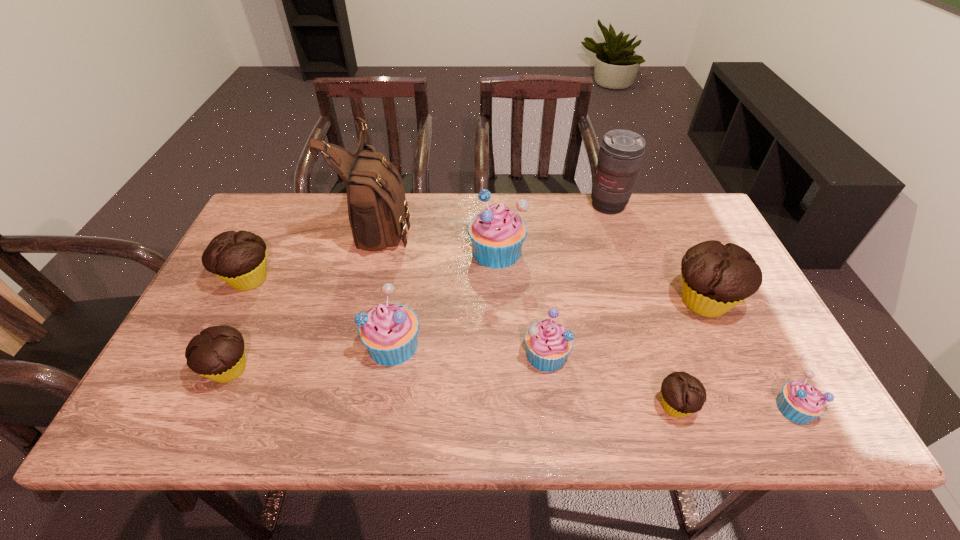
This screenshot has width=960, height=540. I want to click on chocolate muffin that is the third closest one to the sixth muffin from right to left, so click(x=682, y=394).

This screenshot has width=960, height=540. Identify the location of vacant area that satisfies the following two spatial constraints: 1. on the back side of the third muffin from left to right; 2. on the left side of the farthest blue muffin. (408, 251).

Find the location of a particular element. This screenshot has height=540, width=960. free space that satisfies the following two spatial constraints: 1. on the side of the biggest chocolate muffin where the control switches are located; 2. on the left side of the telephoto lens is located at coordinates (640, 302).

Where is `free space that satisfies the following two spatial constraints: 1. on the front side of the second smallest blue muffin; 2. on the left side of the smallest chocolate muffin`? free space that satisfies the following two spatial constraints: 1. on the front side of the second smallest blue muffin; 2. on the left side of the smallest chocolate muffin is located at coordinates (553, 406).

Identify the location of vacant point that satisfies the following two spatial constraints: 1. on the back side of the rightmost chocolate muffin; 2. on the front-facing side of the brown shoulder bag. The image size is (960, 540). (667, 224).

Find the location of a particular element. The image size is (960, 540). vacant region that satisfies the following two spatial constraints: 1. on the front-facing side of the smallest blue muffin; 2. on the right side of the brown shoulder bag is located at coordinates (336, 408).